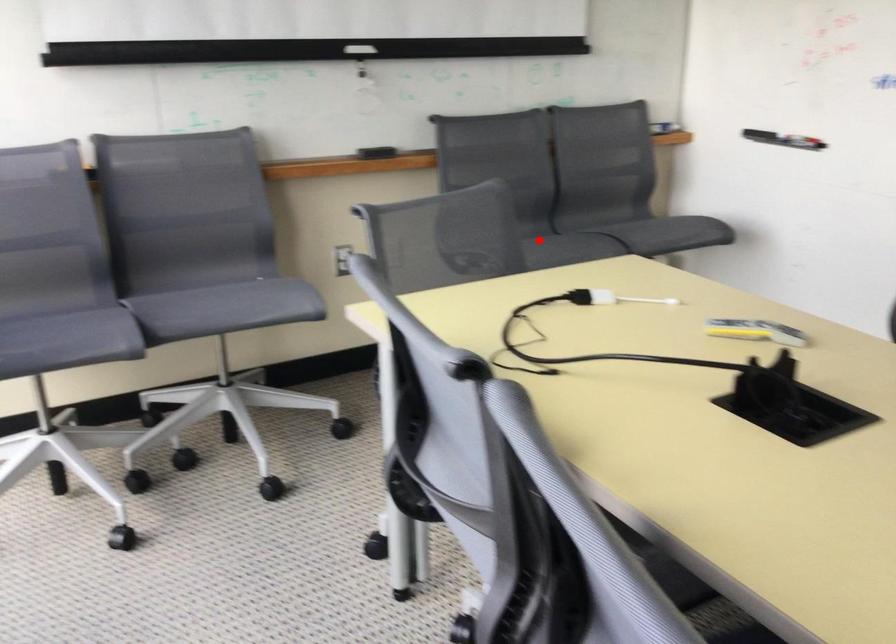
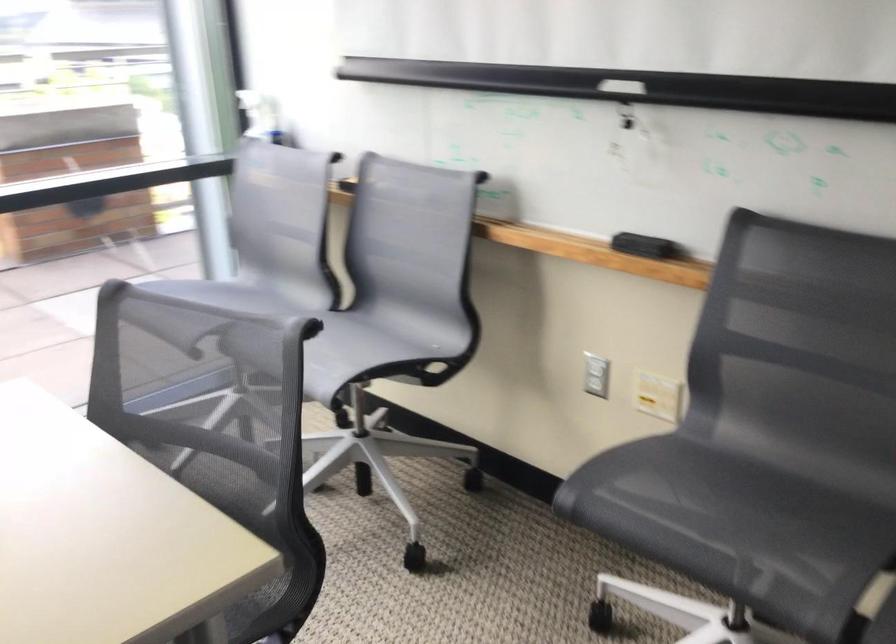
Where in the second image is the point corresponding to the highlighted location from the first image?

(752, 506)